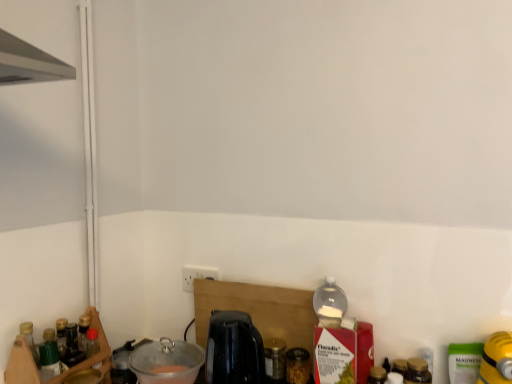
Question: Is wooden spice rack at left facing away from metallic black kettle at lower left, which appears as the first appliance when viewed from the left?

Choices:
 (A) yes
 (B) no

Answer: (B)

Question: From a real-world perspective, is wooden spice rack at left positioned under metallic black kettle at lower left, which appears as the first appliance when viewed from the left, based on gravity?

Choices:
 (A) yes
 (B) no

Answer: (B)

Question: From the image's perspective, is wooden spice rack at left on top of metallic black kettle at lower left, which appears as the first appliance when viewed from the left?

Choices:
 (A) no
 (B) yes

Answer: (B)

Question: Considering the relative sizes of wooden spice rack at left and metallic black kettle at lower left, which appears as the first appliance when viewed from the left, in the image provided, is wooden spice rack at left shorter than metallic black kettle at lower left, which appears as the first appliance when viewed from the left,?

Choices:
 (A) no
 (B) yes

Answer: (A)

Question: Could you tell me if wooden spice rack at left is turned towards metallic black kettle at lower left, arranged as the 3th appliance when viewed from the right?

Choices:
 (A) yes
 (B) no

Answer: (B)

Question: Is wooden spice rack at left completely or partially outside of metallic black kettle at lower left, which appears as the first appliance when viewed from the left?

Choices:
 (A) no
 (B) yes

Answer: (B)

Question: Is transparent glass jar at center, the 3th bottle viewed from the right, far away from black glossy coffee machine at center?

Choices:
 (A) yes
 (B) no

Answer: (B)

Question: Does transparent glass jar at center, arranged as the 3th bottle when viewed from the front, have a smaller size compared to black glossy coffee machine at center?

Choices:
 (A) yes
 (B) no

Answer: (A)

Question: Is transparent glass jar at center, marked as the first bottle in a back-to-front arrangement, to the left of black glossy coffee machine at center from the viewer's perspective?

Choices:
 (A) yes
 (B) no

Answer: (B)

Question: Is black glossy coffee machine at center at the back of transparent glass jar at center, the 3th bottle viewed from the right?

Choices:
 (A) yes
 (B) no

Answer: (B)

Question: Can you confirm if transparent glass jar at center, the 3th bottle viewed from the right, is bigger than black glossy coffee machine at center?

Choices:
 (A) no
 (B) yes

Answer: (A)

Question: From a real-world perspective, is transparent glass jar at center, the 3th bottle viewed from the right, beneath black glossy coffee machine at center?

Choices:
 (A) yes
 (B) no

Answer: (A)

Question: Considering the relative positions of translucent glass jar at center, which ranks as the 2th bottle in right-to-left order, and clear plastic bowl at lower left, the second appliance positioned from the right, in the image provided, is translucent glass jar at center, which ranks as the 2th bottle in right-to-left order, to the right of clear plastic bowl at lower left, the second appliance positioned from the right, from the viewer's perspective?

Choices:
 (A) yes
 (B) no

Answer: (A)